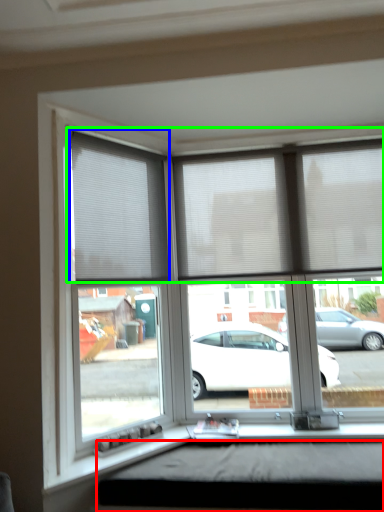
Question: Estimate the real-world distances between objects in this image. Which object is farther from window box (highlighted by a red box), window blind (highlighted by a blue box) or blind (highlighted by a green box)?

Choices:
 (A) window blind
 (B) blind

Answer: (A)